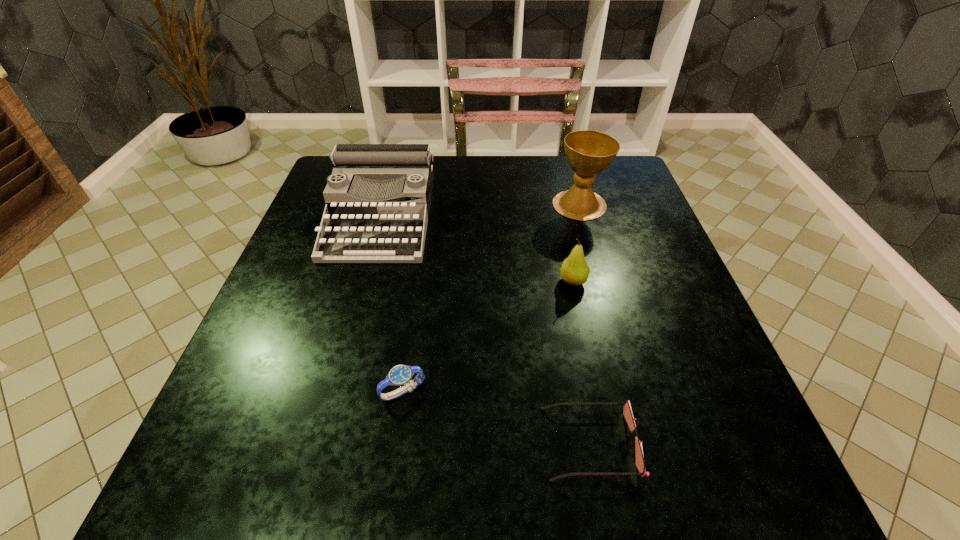
Identify the location of object that is positioned at the far right corner. The image size is (960, 540). (588, 152).

The height and width of the screenshot is (540, 960). I want to click on vacant space at the far edge of the desktop, so click(510, 177).

Identify the location of vacant area at the near edge. The image size is (960, 540). (656, 500).

In order to click on free location at the left edge in this screenshot , I will do `click(303, 289)`.

Where is `vacant space at the right edge of the desktop`? vacant space at the right edge of the desktop is located at coordinates (670, 291).

This screenshot has height=540, width=960. In order to click on unoccupied position between the chalice and the typewriter in this screenshot , I will do `click(480, 210)`.

At what (x,y) coordinates should I click in order to perform the action: click on free spot between the typewriter and the third nearest object. Please return your answer as a coordinate pair (x, y). Looking at the image, I should click on (477, 248).

Where is `vacant area between the typewriter and the chalice`? This screenshot has width=960, height=540. vacant area between the typewriter and the chalice is located at coordinates (480, 210).

Image resolution: width=960 pixels, height=540 pixels. I want to click on free space between the chalice and the fourth tallest object, so click(492, 298).

Find the location of a particular element. The height and width of the screenshot is (540, 960). free spot between the typewriter and the nearest object is located at coordinates (486, 329).